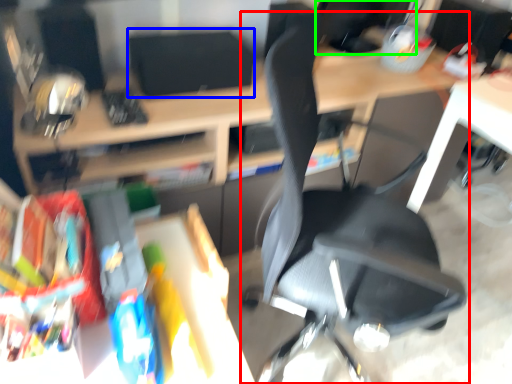
Question: Which object is the closest to the chair (highlighted by a red box)? Choose among these: computer monitor (highlighted by a blue box) or computer monitor (highlighted by a green box).

Choices:
 (A) computer monitor
 (B) computer monitor

Answer: (A)